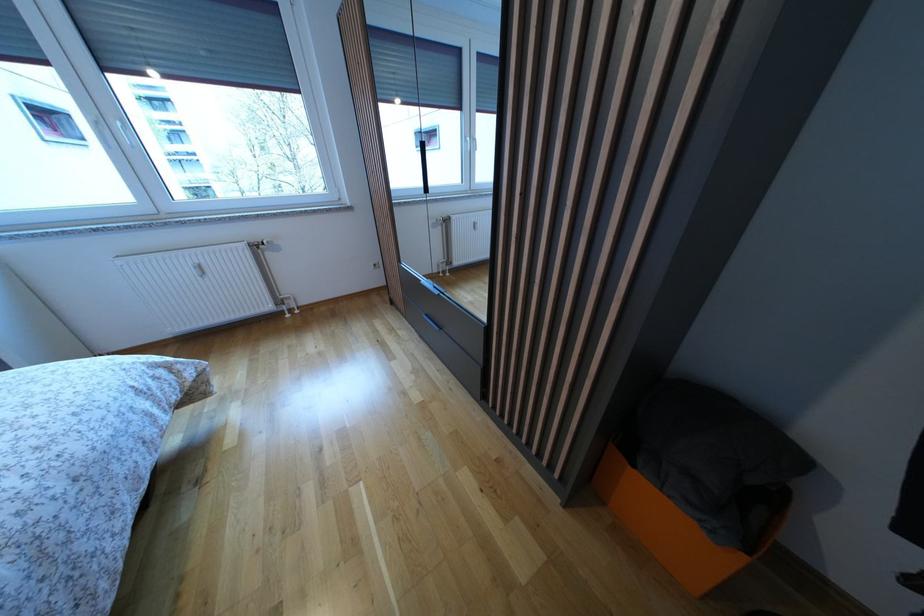
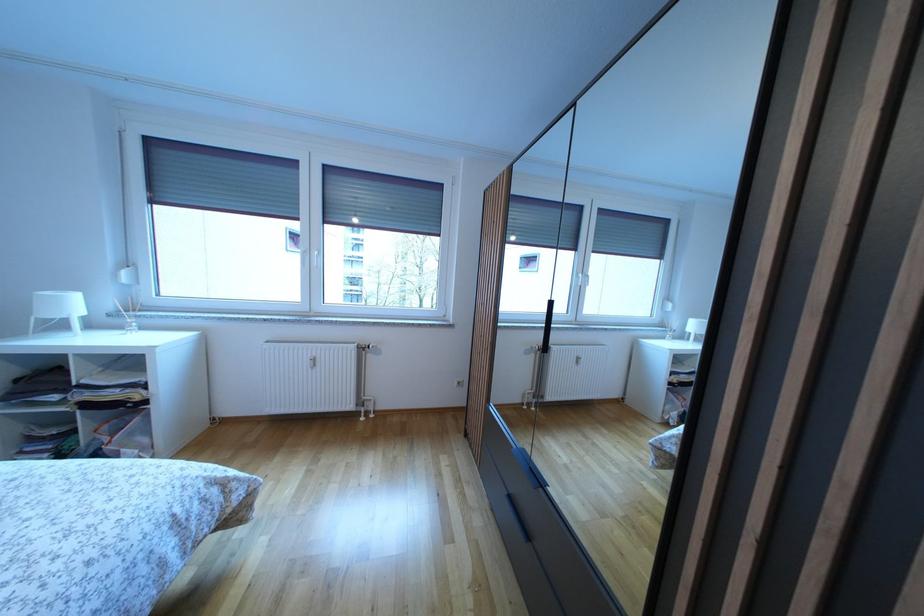
First-person continuous shooting, in which direction is the camera rotating?

The camera rotated toward left-up.